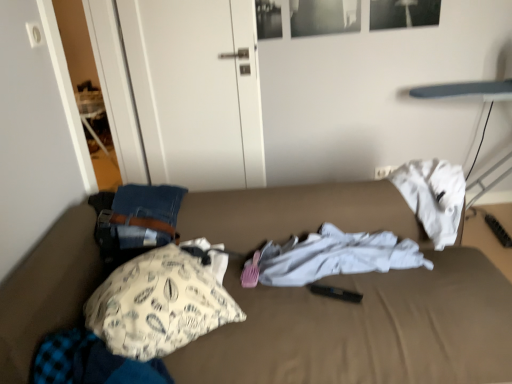
Question: From the image's perspective, would you say fluffy blue blanket at lower left, arranged as the second clothing when viewed from the back, is shown under white matte door at upper left?

Choices:
 (A) no
 (B) yes

Answer: (B)

Question: Can you confirm if fluffy blue blanket at lower left, the 1th clothing in the left-to-right sequence, is smaller than white matte door at upper left?

Choices:
 (A) yes
 (B) no

Answer: (A)

Question: Can you confirm if fluffy blue blanket at lower left, arranged as the second clothing when viewed from the back, is shorter than white matte door at upper left?

Choices:
 (A) yes
 (B) no

Answer: (A)

Question: Is fluffy blue blanket at lower left, the 1th clothing in the bottom-to-top sequence, far from white matte door at upper left?

Choices:
 (A) yes
 (B) no

Answer: (A)

Question: Considering the relative sizes of fluffy blue blanket at lower left, arranged as the second clothing when viewed from the back, and white matte door at upper left in the image provided, is fluffy blue blanket at lower left, arranged as the second clothing when viewed from the back, taller than white matte door at upper left?

Choices:
 (A) no
 (B) yes

Answer: (A)

Question: Considering the positions of point tap(252, 81) and point tap(354, 269), is point tap(252, 81) closer or farther from the camera than point tap(354, 269)?

Choices:
 (A) farther
 (B) closer

Answer: (A)

Question: From a real-world perspective, is white matte door at upper left above or below white cotton shirt at center, placed as the second clothing when sorted from front to back?

Choices:
 (A) above
 (B) below

Answer: (A)

Question: Is white matte door at upper left inside or outside of white cotton shirt at center, the 1th clothing in the top-to-bottom sequence?

Choices:
 (A) outside
 (B) inside

Answer: (A)

Question: In terms of width, does white matte door at upper left look wider or thinner when compared to white cotton shirt at center, positioned as the 1th clothing in right-to-left order?

Choices:
 (A) thin
 (B) wide

Answer: (A)

Question: Considering the positions of brown fabric bed at center and white cotton shirt at center, which ranks as the second clothing in left-to-right order, in the image, is brown fabric bed at center bigger or smaller than white cotton shirt at center, which ranks as the second clothing in left-to-right order,?

Choices:
 (A) small
 (B) big

Answer: (B)

Question: Based on their positions, is brown fabric bed at center located to the left or right of white cotton shirt at center, positioned as the 1th clothing in right-to-left order?

Choices:
 (A) left
 (B) right

Answer: (A)

Question: Is brown fabric bed at center in front of or behind white cotton shirt at center, the second clothing when ordered from bottom to top, in the image?

Choices:
 (A) behind
 (B) front

Answer: (B)

Question: From the image's perspective, relative to white cotton shirt at center, the second clothing when ordered from bottom to top, is brown fabric bed at center above or below?

Choices:
 (A) below
 (B) above

Answer: (A)

Question: Considering the positions of brown fabric bed at center and white matte door at upper left in the image, is brown fabric bed at center wider or thinner than white matte door at upper left?

Choices:
 (A) wide
 (B) thin

Answer: (A)

Question: In terms of size, does brown fabric bed at center appear bigger or smaller than white matte door at upper left?

Choices:
 (A) big
 (B) small

Answer: (A)